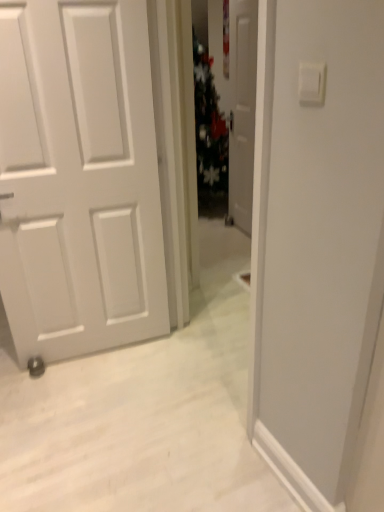
Question: From their relative heights in the image, would you say white plastic light switch at upper right is taller or shorter than white glossy door at center?

Choices:
 (A) short
 (B) tall

Answer: (A)

Question: Based on their positions, is white plastic light switch at upper right located to the left or right of white glossy door at center?

Choices:
 (A) right
 (B) left

Answer: (B)

Question: From the image's perspective, is white plastic light switch at upper right positioned above or below white glossy door at center?

Choices:
 (A) above
 (B) below

Answer: (B)

Question: Is white glossy door at center spatially inside white plastic light switch at upper right, or outside of it?

Choices:
 (A) inside
 (B) outside

Answer: (B)

Question: From a real-world perspective, relative to white plastic light switch at upper right, is white glossy door at center vertically above or below?

Choices:
 (A) above
 (B) below

Answer: (B)

Question: From the image's perspective, relative to white plastic light switch at upper right, is white glossy door at center above or below?

Choices:
 (A) above
 (B) below

Answer: (A)

Question: Considering the positions of white glossy door at center and white plastic light switch at upper right in the image, is white glossy door at center wider or thinner than white plastic light switch at upper right?

Choices:
 (A) thin
 (B) wide

Answer: (B)